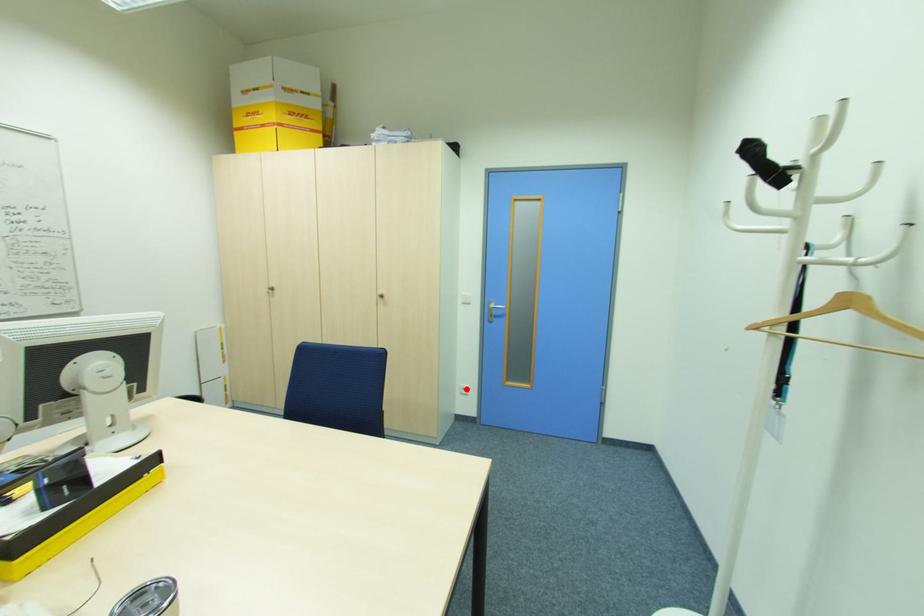
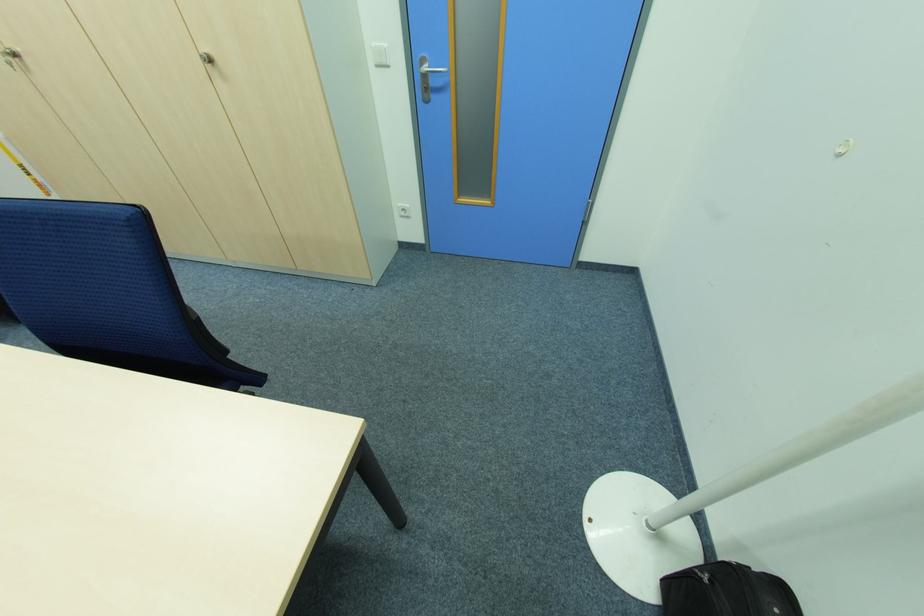
Question: I am providing you with two images of the same scene from different viewpoints. Image1 has a red point marked. In image2, the corresponding 3D location appears at what relative position? Reply with the corresponding letter.

Choices:
 (A) Closer
 (B) Farther

Answer: (A)